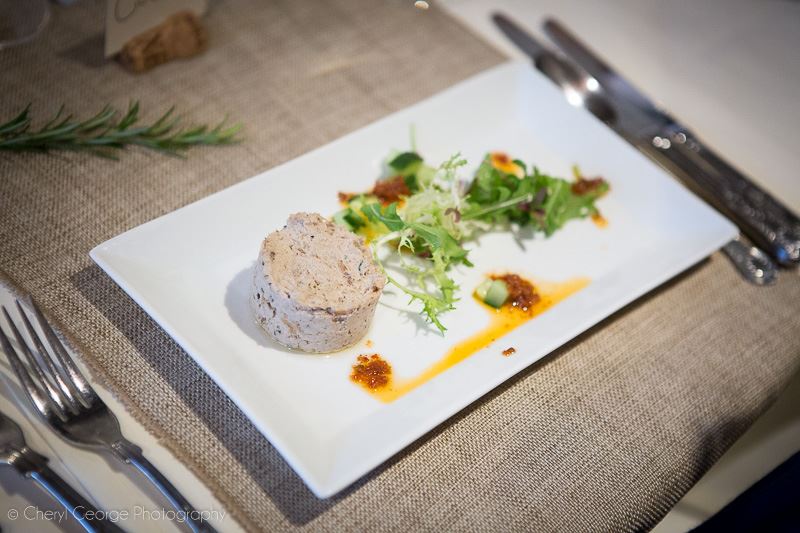
The image size is (800, 533). In order to click on brown wine cork in this screenshot , I will do `click(150, 46)`.